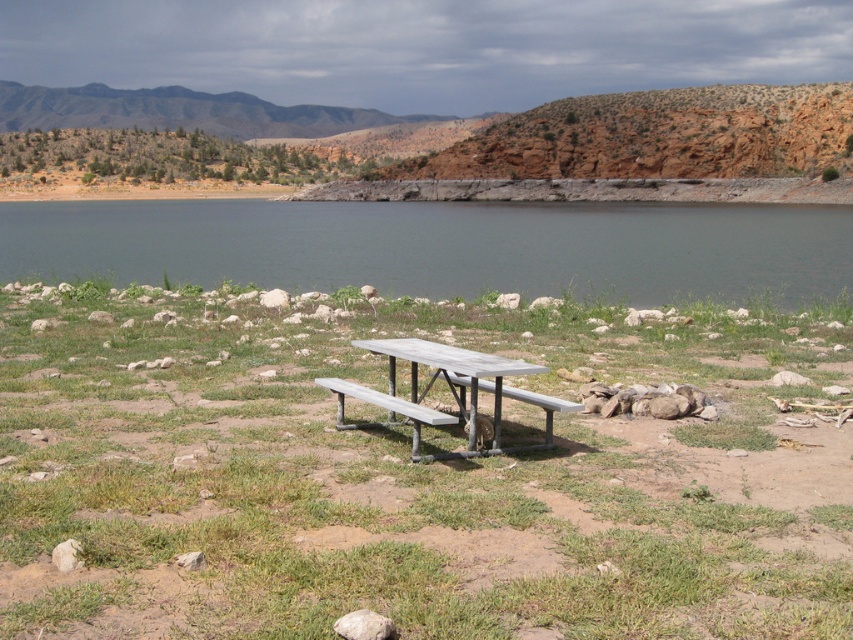
From the picture: You are planning to set up a small tent between the gray metallic bench at center and the metallic silver park bench at center. Which bench should you place the tent closer to if you want it nearer to the left side of the scene?

You should place the tent closer to the gray metallic bench at center because it is positioned to the left of the metallic silver park bench at center.

You are planning to set up a tent for a camping trip and need to choose between the green grass at center and the wooden picnic table at center as the location. Which surface is taller and more suitable for placing the tent legs?

The green grass at center is taller than the wooden picnic table at center, so it is more suitable for placing the tent legs as it provides a level surface.